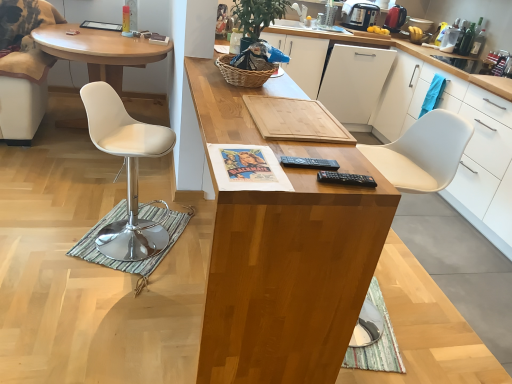
At what (x,y) coordinates should I click in order to perform the action: click on free spot above wooden at center, the 1th desk in the right-to-left sequence (from a real-world perspective). Please return your answer as a coordinate pair (x, y). The height and width of the screenshot is (384, 512). Looking at the image, I should click on point(283,104).